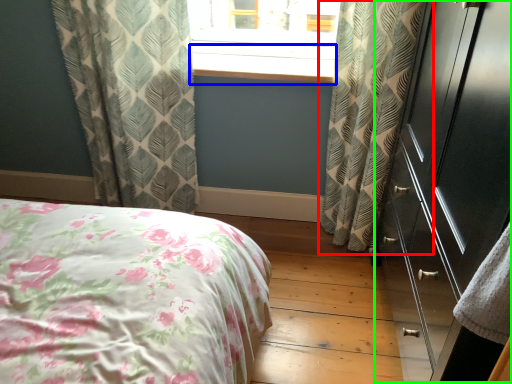
Question: Considering the real-world distances, which object is farthest from curtain (highlighted by a red box)? window sill (highlighted by a blue box) or dresser (highlighted by a green box)?

Choices:
 (A) window sill
 (B) dresser

Answer: (A)